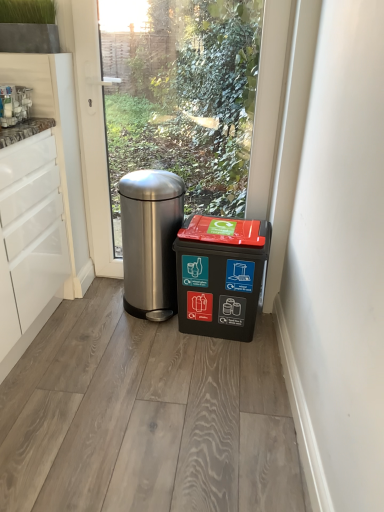
Locate an element on the screen. This screenshot has height=512, width=384. free space in front of polished stainless steel trash can at center, positioned as the first waste container in left-to-right order is located at coordinates (139, 340).